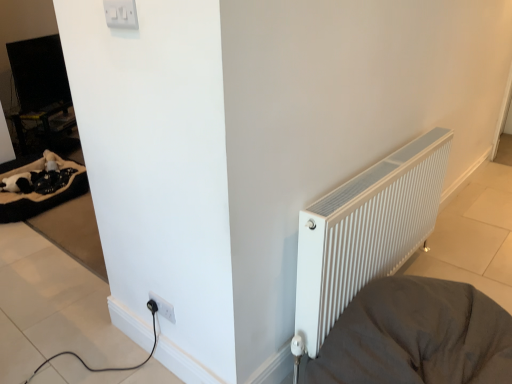
Question: Considering the relative sizes of white plastic switch at upper center, marked as the first electric outlet in a top-to-bottom arrangement, and white ribbed radiator at right in the image provided, is white plastic switch at upper center, marked as the first electric outlet in a top-to-bottom arrangement, taller than white ribbed radiator at right?

Choices:
 (A) no
 (B) yes

Answer: (A)

Question: Is white plastic switch at upper center, placed as the 2th electric outlet when sorted from back to front, oriented towards white ribbed radiator at right?

Choices:
 (A) no
 (B) yes

Answer: (A)

Question: Can white ribbed radiator at right be found inside white plastic switch at upper center, which is counted as the 1th electric outlet, starting from the front?

Choices:
 (A) no
 (B) yes

Answer: (A)

Question: Can you confirm if white plastic switch at upper center, placed as the 2th electric outlet when sorted from back to front, is wider than white ribbed radiator at right?

Choices:
 (A) no
 (B) yes

Answer: (A)

Question: Is white plastic switch at upper center, which is counted as the 1th electric outlet, starting from the front, next to white ribbed radiator at right and touching it?

Choices:
 (A) no
 (B) yes

Answer: (A)

Question: From the image's perspective, is white plastic switch at upper center, marked as the first electric outlet in a top-to-bottom arrangement, on top of white ribbed radiator at right?

Choices:
 (A) yes
 (B) no

Answer: (A)

Question: Is white plastic switch at upper center, placed as the second electric outlet when sorted from bottom to top, directly adjacent to wooden table at left?

Choices:
 (A) yes
 (B) no

Answer: (B)

Question: Considering the relative positions of white plastic switch at upper center, marked as the first electric outlet in a top-to-bottom arrangement, and wooden table at left in the image provided, is white plastic switch at upper center, marked as the first electric outlet in a top-to-bottom arrangement, to the left of wooden table at left from the viewer's perspective?

Choices:
 (A) yes
 (B) no

Answer: (B)

Question: Is white plastic switch at upper center, placed as the second electric outlet when sorted from bottom to top, closer to camera compared to wooden table at left?

Choices:
 (A) no
 (B) yes

Answer: (B)

Question: From the image's perspective, is white plastic switch at upper center, which is counted as the 1th electric outlet, starting from the front, beneath wooden table at left?

Choices:
 (A) no
 (B) yes

Answer: (B)

Question: Can wooden table at left be found inside white plastic switch at upper center, which is counted as the 1th electric outlet, starting from the front?

Choices:
 (A) yes
 (B) no

Answer: (B)

Question: Does white plastic switch at upper center, marked as the first electric outlet in a top-to-bottom arrangement, have a lesser height compared to wooden table at left?

Choices:
 (A) yes
 (B) no

Answer: (A)

Question: From a real-world perspective, is wooden table at left on top of white ribbed radiator at right?

Choices:
 (A) no
 (B) yes

Answer: (A)